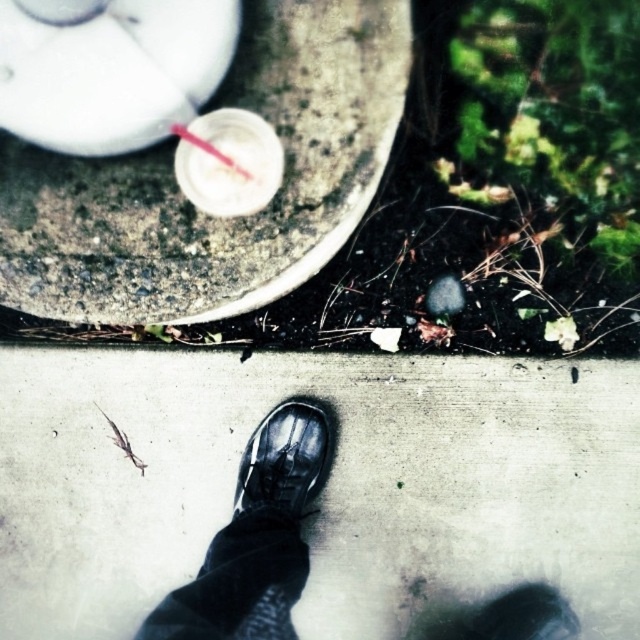
Consider the image. Can you confirm if matte concrete sidewalk at center is positioned to the right of clear plastic straw at center?

Indeed, matte concrete sidewalk at center is positioned on the right side of clear plastic straw at center.

Is matte concrete sidewalk at center wider than clear plastic straw at center?

Correct, the width of matte concrete sidewalk at center exceeds that of clear plastic straw at center.

What do you see at coordinates (324, 486) in the screenshot? The image size is (640, 640). I see `matte concrete sidewalk at center` at bounding box center [324, 486].

Where is `matte concrete sidewalk at center`? This screenshot has height=640, width=640. matte concrete sidewalk at center is located at coordinates (324, 486).

The width and height of the screenshot is (640, 640). What do you see at coordinates (192, 205) in the screenshot?
I see `gray concrete at upper center` at bounding box center [192, 205].

Who is more forward, (282,236) or (259,481)?

Point (282,236)

You are a GUI agent. You are given a task and a screenshot of the screen. Output one action in this format:
    pyautogui.click(x=<x>, y=<y>)
    Task: Click on the gray concrete at upper center
    The height and width of the screenshot is (640, 640).
    Given the screenshot: What is the action you would take?
    pyautogui.click(x=192, y=205)

Between shiny black shoe at center and clear plastic straw at center, which one appears on the left side from the viewer's perspective?

clear plastic straw at center is more to the left.

Is point (273, 506) more distant than point (205, 147)?

Yes, point (273, 506) is behind point (205, 147).

At what (x,y) coordinates should I click in order to perform the action: click on shiny black shoe at center. Please return your answer as a coordinate pair (x, y). The image size is (640, 640). Looking at the image, I should click on (284, 460).